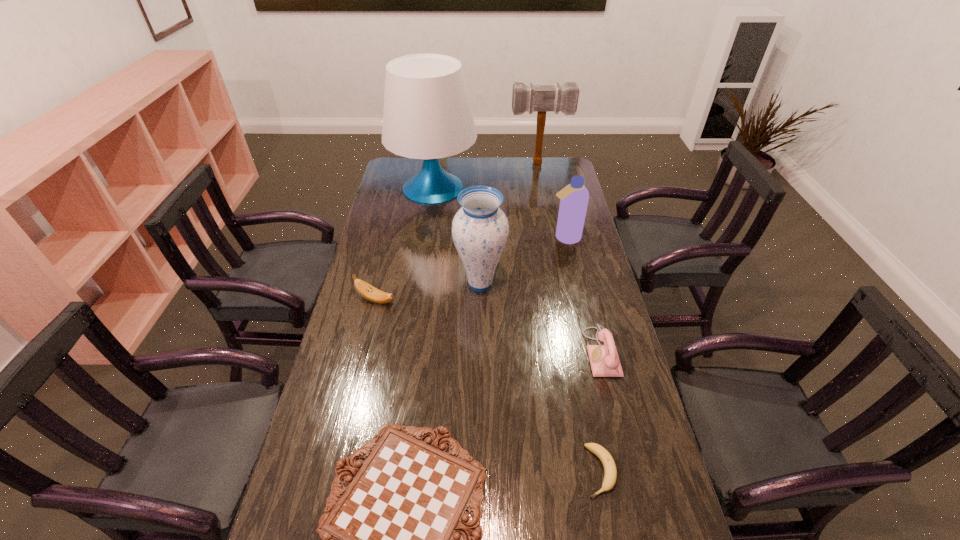
Where is `mallet that is at the far edge`? mallet that is at the far edge is located at coordinates (530, 98).

I want to click on table lamp that is at the left edge, so click(x=427, y=115).

At what (x,y) coordinates should I click in order to perform the action: click on banana that is at the left edge. Please return your answer as a coordinate pair (x, y). The width and height of the screenshot is (960, 540). Looking at the image, I should click on (366, 290).

Where is `mallet that is at the right edge`? This screenshot has width=960, height=540. mallet that is at the right edge is located at coordinates (530, 98).

Where is `shampoo located at the right edge`? shampoo located at the right edge is located at coordinates (574, 197).

This screenshot has height=540, width=960. In order to click on telephone at the right edge in this screenshot , I will do `click(604, 360)`.

This screenshot has width=960, height=540. Find the location of `banana situated at the right edge`. banana situated at the right edge is located at coordinates (610, 472).

The width and height of the screenshot is (960, 540). I want to click on object at the far left corner, so click(427, 115).

In order to click on object that is positioned at the far right corner in this screenshot , I will do `click(530, 98)`.

This screenshot has width=960, height=540. Identify the location of blank area at the far edge. (516, 175).